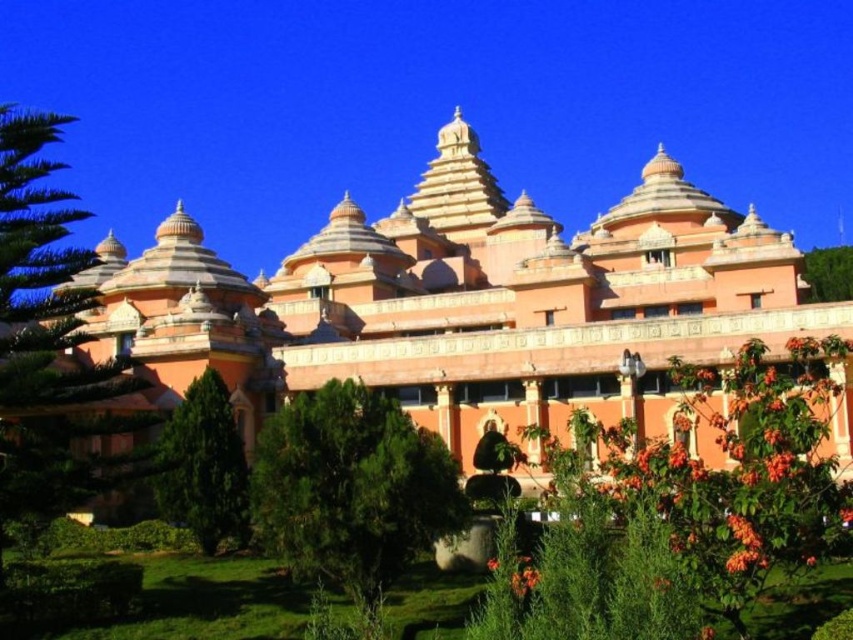
Is green leafy tree at center above green leafy tree at upper right?

Actually, green leafy tree at center is below green leafy tree at upper right.

Is point (341, 557) in front of point (820, 291)?

Yes, point (341, 557) is closer to viewer.

Image resolution: width=853 pixels, height=640 pixels. In order to click on green leafy tree at center in this screenshot , I will do `click(351, 486)`.

Does orange matte building at center have a smaller size compared to green leafy tree at lower left?

No, orange matte building at center is not smaller than green leafy tree at lower left.

Is point (585, 324) positioned in front of point (244, 476)?

No.

This screenshot has height=640, width=853. What are the coordinates of `orange matte building at center` in the screenshot? It's located at (462, 301).

Consider the image. Which of these two, orange matte building at center or green leafy tree at left, stands taller?

green leafy tree at left

Does orange matte building at center appear on the left side of green leafy tree at left?

In fact, orange matte building at center is to the right of green leafy tree at left.

What are the coordinates of `orange matte building at center` in the screenshot? It's located at (462, 301).